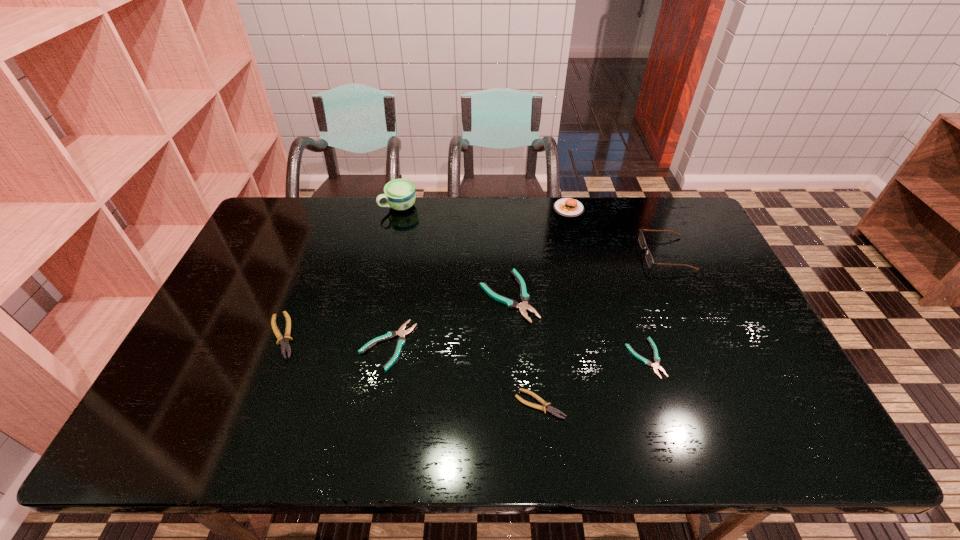
At what (x,y) coordinates should I click in order to perform the action: click on vacant space at the near edge of the desktop. Please return your answer as a coordinate pair (x, y). The width and height of the screenshot is (960, 540). Looking at the image, I should click on (548, 449).

Where is `vacant space at the left edge`? The height and width of the screenshot is (540, 960). vacant space at the left edge is located at coordinates (251, 276).

Locate an element on the screen. The image size is (960, 540). blank space at the right edge of the desktop is located at coordinates [780, 366].

Identify the location of vacant region at the far left corner of the desktop. (316, 204).

You are a GUI agent. You are given a task and a screenshot of the screen. Output one action in this format:
    pyautogui.click(x=<x>, y=<y>)
    Task: Click on the vacant area that lies between the cup and the third object from right to left
    The image size is (960, 540).
    Given the screenshot: What is the action you would take?
    pyautogui.click(x=484, y=208)

This screenshot has width=960, height=540. Identify the location of unoccupied position between the leftmost teal pliers and the rightmost teal pliers. (516, 352).

Identify the location of vacant point located between the biggest teal pliers and the rightmost object. The image size is (960, 540). (588, 275).

Where is `free space between the second teal pliers from left to right and the cup`? The image size is (960, 540). free space between the second teal pliers from left to right and the cup is located at coordinates (454, 251).

This screenshot has width=960, height=540. In order to click on vacant region between the second teal pliers from right to left and the bigger yellow pliers in this screenshot , I will do `click(396, 316)`.

Find the location of a particular element. This screenshot has width=960, height=540. vacant space in between the spectacles and the bigger yellow pliers is located at coordinates (474, 295).